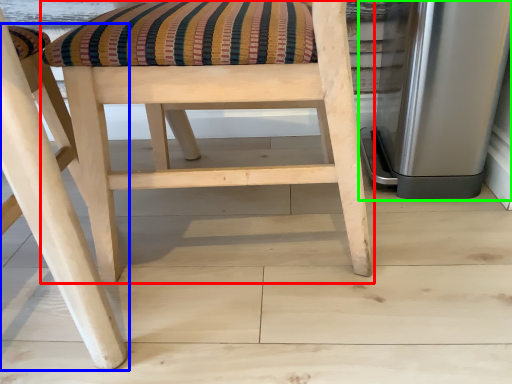
Question: Which object is positioned closest to chair (highlighted by a red box)? Select from chair (highlighted by a blue box) and appliance (highlighted by a green box).

Choices:
 (A) chair
 (B) appliance

Answer: (A)